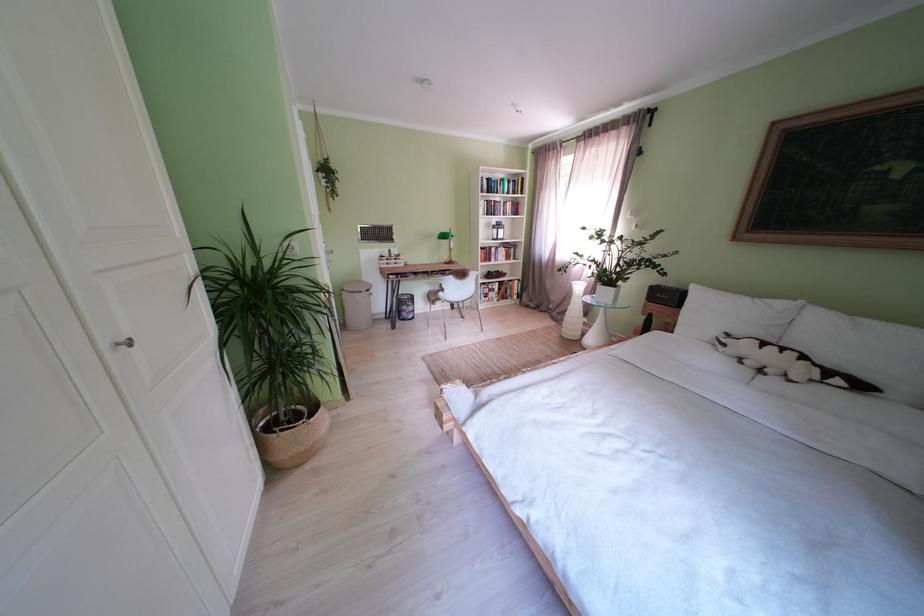
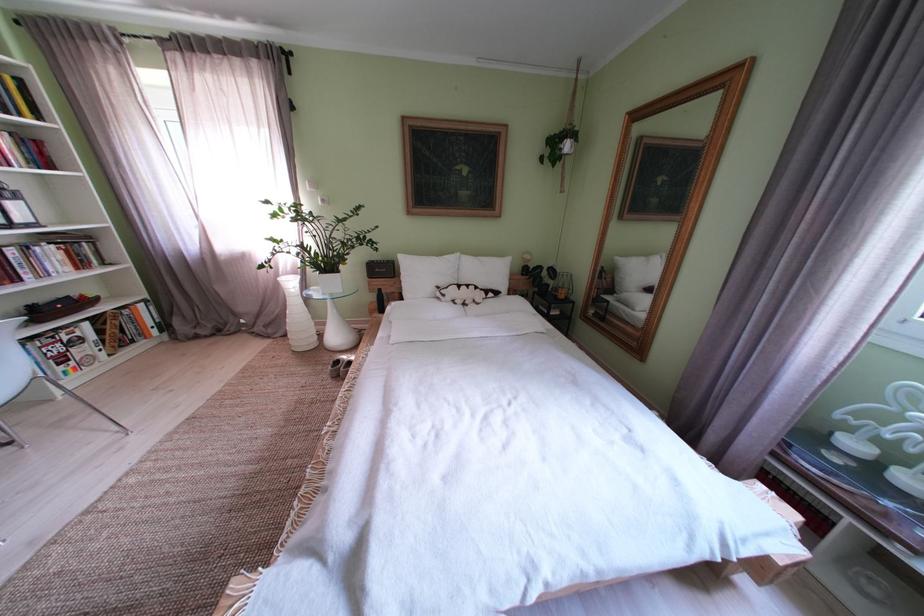
Locate, in the second image, the point that corresponds to the point at 879,326 in the first image.

(492, 264)